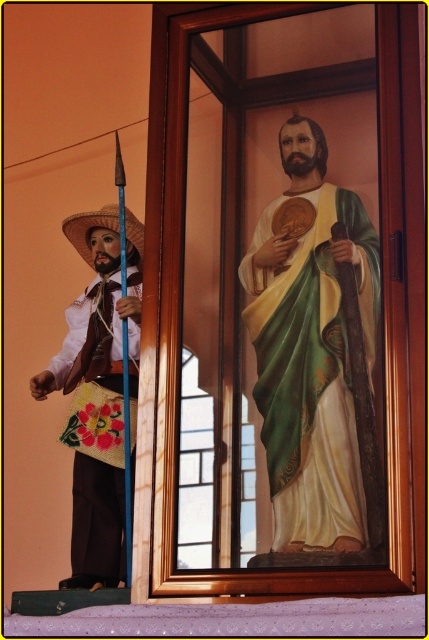
Question: Which point appears closest to the camera in this image?

Choices:
 (A) (88, 236)
 (B) (81, 445)
 (C) (284, 248)

Answer: (C)

Question: Which point is closer to the camera?

Choices:
 (A) strawmaterial/texturecowboy hat at left
 (B) matte green robe at center

Answer: (B)

Question: Where is embroidered fabric purse at left located in relation to strawmaterial/texturecowboy hat at left in the image?

Choices:
 (A) below
 (B) above

Answer: (A)

Question: Among these points, which one is nearest to the camera?

Choices:
 (A) (103, 205)
 (B) (331, 244)

Answer: (B)

Question: Is embroidered fabric purse at left wider than strawmaterial/texturecowboy hat at left?

Choices:
 (A) yes
 (B) no

Answer: (A)

Question: Does matte green robe at center appear on the left side of strawmaterial/texturecowboy hat at left?

Choices:
 (A) no
 (B) yes

Answer: (A)